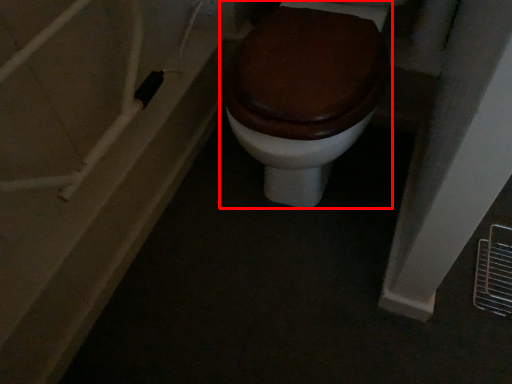
Question: From the image's perspective, where is toilet (annotated by the red box) located relative to bath?

Choices:
 (A) below
 (B) above

Answer: (B)